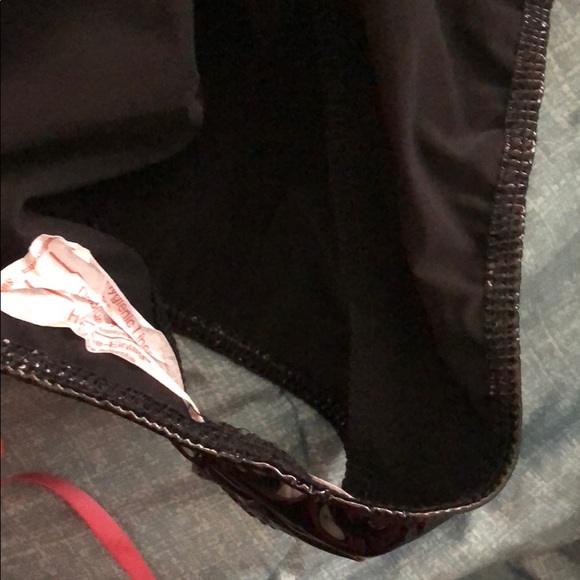
The image size is (580, 580). Find the location of `crumpled up receipt`. crumpled up receipt is located at coordinates (48, 295).